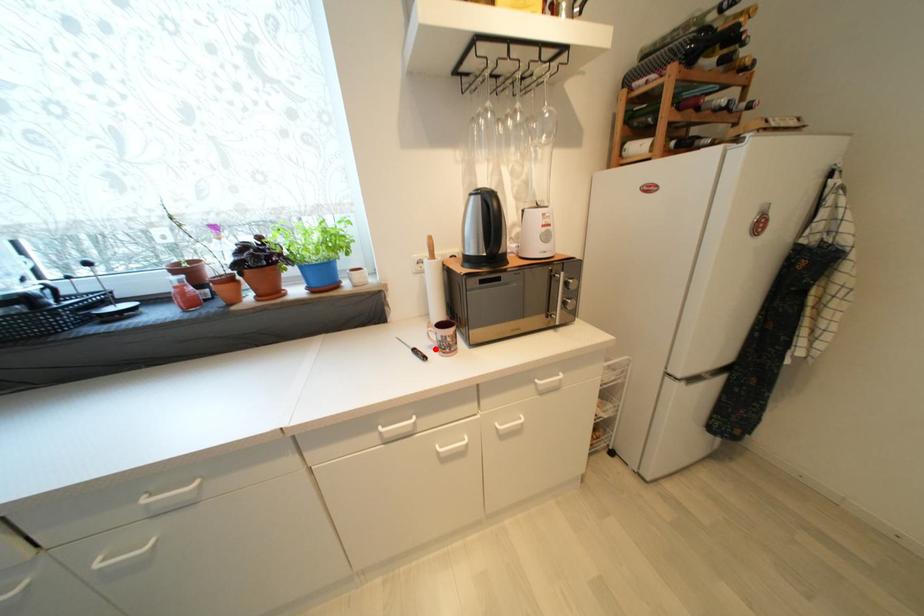
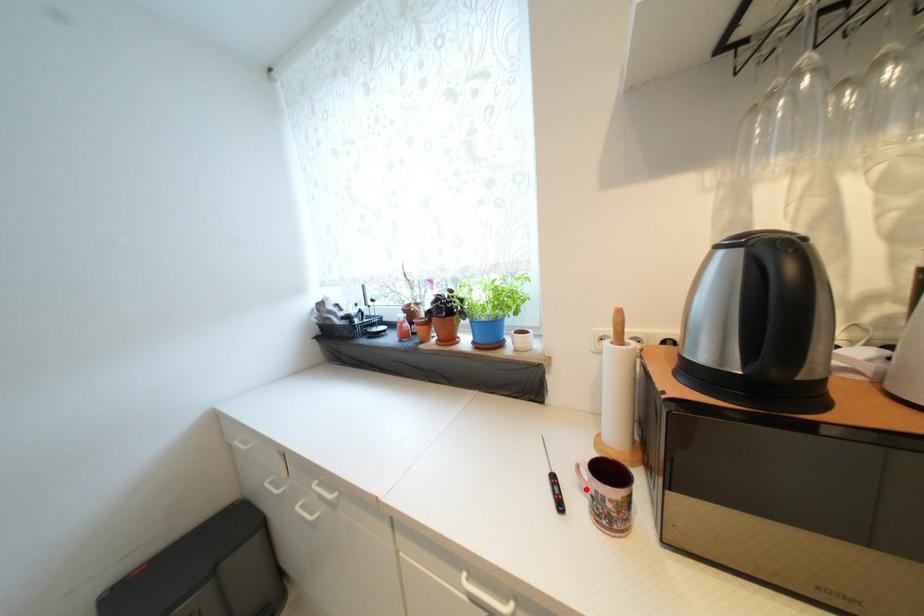
I am providing you with two images of the same scene from different viewpoints. A red point is marked on the first image and another point is marked on the second image. Does the point marked in image1 correspond to the same location as the one in image2?

Yes